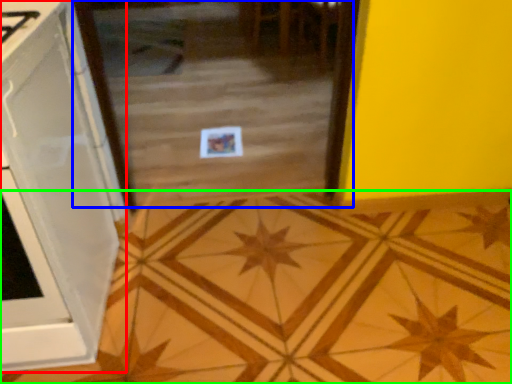
Question: Based on their relative distances, which object is farther from cabinetry (highlighted by a red box)? Choose from glass door (highlighted by a blue box) and ceramic tile (highlighted by a green box).

Choices:
 (A) glass door
 (B) ceramic tile

Answer: (A)